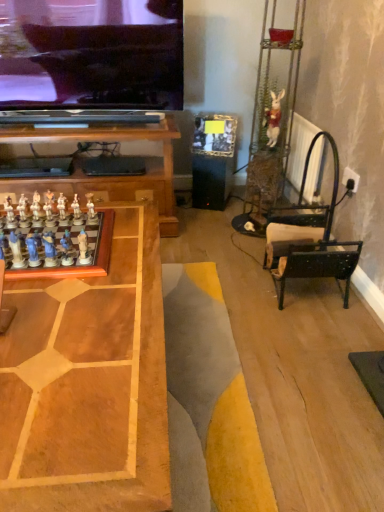
Image resolution: width=384 pixels, height=512 pixels. What are the coordinates of `free location to the right of white glossy chess piece at left, positioned as the 4th toy in back-to-front order` in the screenshot? It's located at (117, 222).